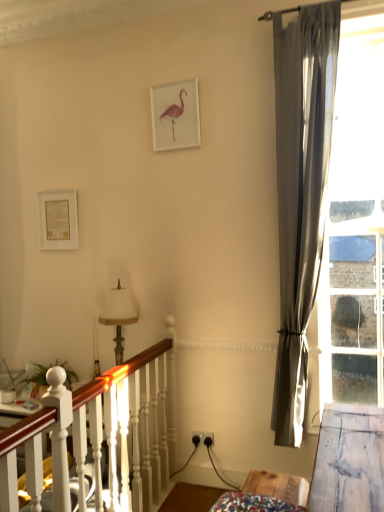
Question: Is white matte picture frame at upper center, the 2th picture frame when ordered from bottom to top, located within satin gray curtain at right?

Choices:
 (A) yes
 (B) no

Answer: (B)

Question: Could you tell me if satin gray curtain at right is facing white matte picture frame at upper center, positioned as the first picture frame in top-to-bottom order?

Choices:
 (A) no
 (B) yes

Answer: (A)

Question: Does satin gray curtain at right appear on the left side of white matte picture frame at upper center, the 2th picture frame when ordered from bottom to top?

Choices:
 (A) yes
 (B) no

Answer: (B)

Question: Can you confirm if satin gray curtain at right is thinner than white matte picture frame at upper center, the 2th picture frame when ordered from bottom to top?

Choices:
 (A) no
 (B) yes

Answer: (A)

Question: Is satin gray curtain at right touching white matte picture frame at upper center, positioned as the first picture frame in top-to-bottom order?

Choices:
 (A) yes
 (B) no

Answer: (B)

Question: From the image's perspective, would you say satin gray curtain at right is shown under white matte picture frame at upper center, positioned as the first picture frame in top-to-bottom order?

Choices:
 (A) yes
 (B) no

Answer: (A)

Question: Does clear glass window at right contain satin gray curtain at right?

Choices:
 (A) yes
 (B) no

Answer: (B)

Question: Considering the relative sizes of clear glass window at right and satin gray curtain at right in the image provided, is clear glass window at right smaller than satin gray curtain at right?

Choices:
 (A) yes
 (B) no

Answer: (A)

Question: Can you see clear glass window at right touching satin gray curtain at right?

Choices:
 (A) no
 (B) yes

Answer: (A)

Question: From a real-world perspective, is clear glass window at right under satin gray curtain at right?

Choices:
 (A) yes
 (B) no

Answer: (B)

Question: Considering the relative positions of clear glass window at right and satin gray curtain at right in the image provided, is clear glass window at right behind satin gray curtain at right?

Choices:
 (A) yes
 (B) no

Answer: (A)

Question: From the image's perspective, would you say clear glass window at right is shown under satin gray curtain at right?

Choices:
 (A) yes
 (B) no

Answer: (B)

Question: Is white fabric lampshade at center-left smaller than clear glass window at right?

Choices:
 (A) no
 (B) yes

Answer: (B)